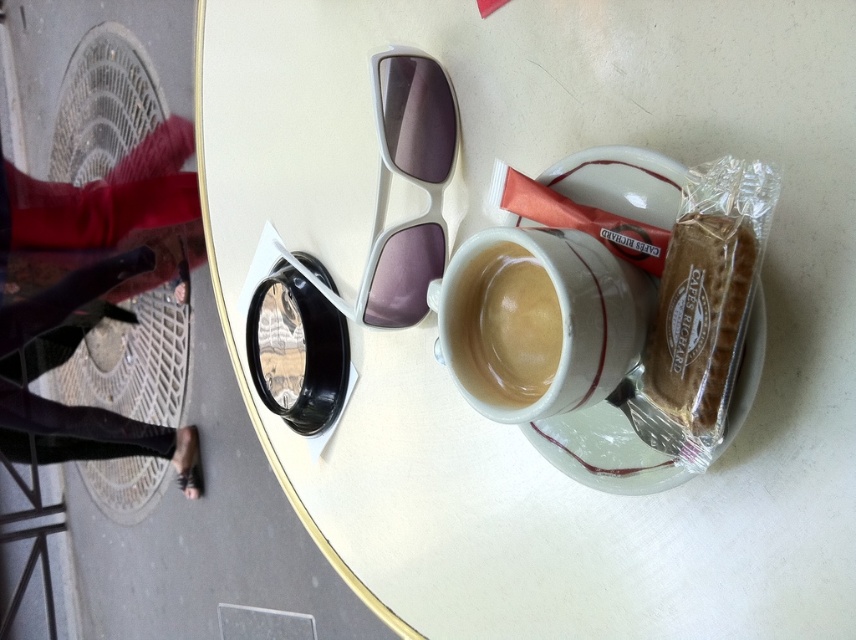
Can you confirm if white ceramic mug at center is smaller than matte ceramic mug at center?

No.

Can you confirm if white ceramic mug at center is positioned to the left of matte ceramic mug at center?

Indeed, white ceramic mug at center is positioned on the left side of matte ceramic mug at center.

Between point (508, 376) and point (557, 324), which one is positioned behind?

Positioned behind is point (508, 376).

Find the location of a particular element. The image size is (856, 640). white ceramic mug at center is located at coordinates (538, 321).

Between point (446, 321) and point (717, 332), which one is positioned behind?

Positioned behind is point (446, 321).

Who is shorter, white ceramic mug at center or brown paper bag at upper right?

white ceramic mug at center is shorter.

Identify the location of white ceramic mug at center. (538, 321).

This screenshot has height=640, width=856. I want to click on white ceramic mug at center, so click(538, 321).

Who is positioned more to the right, black leather pants at lower left or white porcelain saucer at upper center?

white porcelain saucer at upper center is more to the right.

Who is taller, black leather pants at lower left or white porcelain saucer at upper center?

Standing taller between the two is black leather pants at lower left.

At what (x,y) coordinates should I click in order to perform the action: click on black leather pants at lower left. Please return your answer as a coordinate pair (x, y). Image resolution: width=856 pixels, height=640 pixels. Looking at the image, I should click on (92, 292).

The width and height of the screenshot is (856, 640). What are the coordinates of `black leather pants at lower left` in the screenshot? It's located at (92, 292).